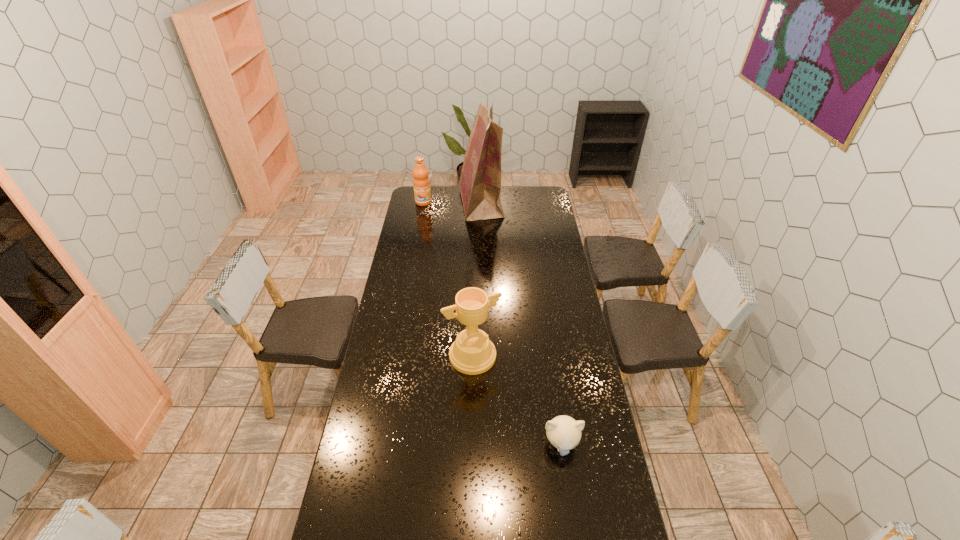
Locate an element on the screen. the tallest object is located at coordinates (480, 182).

Where is `award`? Image resolution: width=960 pixels, height=540 pixels. award is located at coordinates coord(472,353).

Locate an element on the screen. Image resolution: width=960 pixels, height=540 pixels. the leftmost object is located at coordinates (421, 182).

Where is `kitten`? This screenshot has width=960, height=540. kitten is located at coordinates (564, 433).

Identify the location of the rightmost object. (564, 433).

Find the location of a particular element. Image resolution: width=960 pixels, height=540 pixels. free space located 0.170m on the front-facing side of the grocery bag is located at coordinates (430, 204).

Locate an element on the screen. The width and height of the screenshot is (960, 540). free location located on the front-facing side of the grocery bag is located at coordinates (418, 204).

The height and width of the screenshot is (540, 960). I want to click on vacant point located 0.250m on the front-facing side of the grocery bag, so pyautogui.click(x=418, y=204).

Identify the location of free space located 0.240m on the left of the second nearest object. (388, 356).

Locate an element on the screen. vacant region located 0.060m on the label side of the leftmost object is located at coordinates (421, 212).